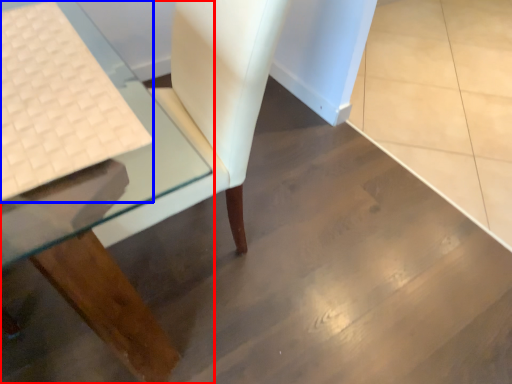
Question: Which of the following is the closest to the observer, table (highlighted by a red box) or laptop keyboard (highlighted by a blue box)?

Choices:
 (A) table
 (B) laptop keyboard

Answer: (A)